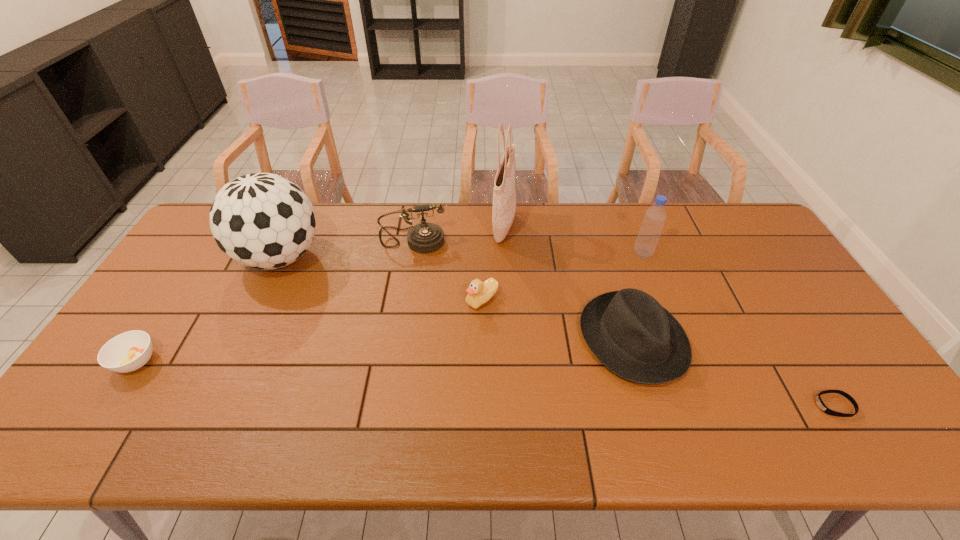
This screenshot has height=540, width=960. I want to click on free space at the far edge, so click(x=477, y=237).

Where is `free region at the near edge of the desktop`? free region at the near edge of the desktop is located at coordinates (836, 446).

Find the location of a particular element. This screenshot has width=960, height=540. free space at the left edge of the desktop is located at coordinates (201, 294).

The width and height of the screenshot is (960, 540). What are the coordinates of `free space at the right edge of the desktop` in the screenshot? It's located at (808, 379).

I want to click on free space at the far right corner, so click(x=735, y=233).

Where is `vacant area that lies between the soup bowl and the fedora`? vacant area that lies between the soup bowl and the fedora is located at coordinates (384, 350).

The width and height of the screenshot is (960, 540). I want to click on vacant space in between the telephone and the tallest object, so click(458, 233).

The height and width of the screenshot is (540, 960). In order to click on vacant space in between the seventh shortest object and the telephone in this screenshot , I will do `click(346, 248)`.

You are a GUI agent. You are given a task and a screenshot of the screen. Output one action in this format:
    pyautogui.click(x=<x>, y=<y>)
    Task: Click on the empty space that is in between the soup bowl and the fedora
    The width and height of the screenshot is (960, 540).
    Given the screenshot: What is the action you would take?
    pyautogui.click(x=384, y=350)

Where is `free space between the third tallest object and the shopping bag`? free space between the third tallest object and the shopping bag is located at coordinates (573, 240).